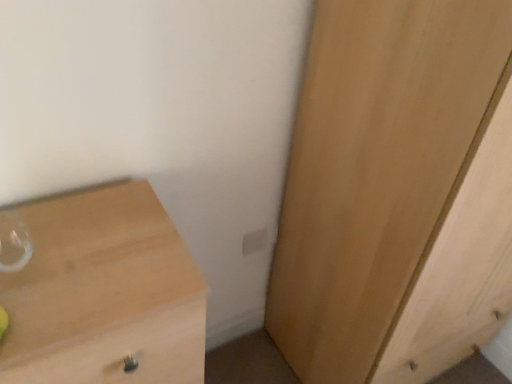
Where is `white plastic electric outlet at center`? This screenshot has height=384, width=512. white plastic electric outlet at center is located at coordinates (254, 241).

This screenshot has width=512, height=384. I want to click on light wood chest of drawers at lower left, so click(99, 291).

Find the location of `the chest of drawers located below the light wood cupboard at right (from the image's perspective)`. the chest of drawers located below the light wood cupboard at right (from the image's perspective) is located at coordinates (99, 291).

Considering the sizes of objects light wood chest of drawers at lower left and light wood cupboard at right in the image provided, who is smaller, light wood chest of drawers at lower left or light wood cupboard at right?

light wood chest of drawers at lower left.

From the image's perspective, who appears lower, light wood chest of drawers at lower left or light wood cupboard at right?

light wood chest of drawers at lower left is shown below in the image.

Which is in front, white plastic electric outlet at center or light wood cupboard at right?

light wood cupboard at right is closer to the camera.

Can we say white plastic electric outlet at center lies outside light wood cupboard at right?

Indeed, white plastic electric outlet at center is completely outside light wood cupboard at right.

Based on the photo, between white plastic electric outlet at center and light wood cupboard at right, which one has smaller size?

With smaller size is white plastic electric outlet at center.

From a real-world perspective, is white plastic electric outlet at center on top of light wood cupboard at right?

No, from a real-world perspective, white plastic electric outlet at center is not above light wood cupboard at right.

Are white plastic electric outlet at center and light wood chest of drawers at lower left far apart?

No.

Consider the image. Is white plastic electric outlet at center shorter than light wood chest of drawers at lower left?

Indeed, white plastic electric outlet at center has a lesser height compared to light wood chest of drawers at lower left.

From the image's perspective, is white plastic electric outlet at center below light wood chest of drawers at lower left?

No, from the image's perspective, white plastic electric outlet at center is not beneath light wood chest of drawers at lower left.

In the scene shown: Looking at the image, does white plastic electric outlet at center seem bigger or smaller compared to light wood chest of drawers at lower left?

In the image, white plastic electric outlet at center appears to be smaller than light wood chest of drawers at lower left.

Which is nearer, (91, 300) or (243, 254)?

The point (91, 300) is more forward.

In the image, is light wood chest of drawers at lower left positioned in front of or behind white plastic electric outlet at center?

light wood chest of drawers at lower left is positioned closer to the viewer than white plastic electric outlet at center.

Is light wood chest of drawers at lower left at the right side of white plastic electric outlet at center?

Incorrect, light wood chest of drawers at lower left is not on the right side of white plastic electric outlet at center.

Does light wood chest of drawers at lower left have a lesser height compared to white plastic electric outlet at center?

No, light wood chest of drawers at lower left is not shorter than white plastic electric outlet at center.

Based on their sizes in the image, would you say light wood cupboard at right is bigger or smaller than light wood chest of drawers at lower left?

In the image, light wood cupboard at right appears to be larger than light wood chest of drawers at lower left.

What's the angular difference between light wood cupboard at right and light wood chest of drawers at lower left's facing directions?

The facing directions of light wood cupboard at right and light wood chest of drawers at lower left are 1.04 degrees apart.

Locate an element on the screen. Image resolution: width=512 pixels, height=384 pixels. chest of drawers below the light wood cupboard at right (from the image's perspective) is located at coordinates (99, 291).

How many degrees apart are the facing directions of light wood cupboard at right and white plastic electric outlet at center?

There is a 1.91-degree angle between the facing directions of light wood cupboard at right and white plastic electric outlet at center.

Can you confirm if light wood cupboard at right is thinner than white plastic electric outlet at center?

In fact, light wood cupboard at right might be wider than white plastic electric outlet at center.

Relative to white plastic electric outlet at center, is light wood cupboard at right in front or behind?

In the image, light wood cupboard at right appears in front of white plastic electric outlet at center.

Image resolution: width=512 pixels, height=384 pixels. What are the coordinates of `cupboard in front of the light wood chest of drawers at lower left` in the screenshot? It's located at (396, 192).

I want to click on cupboard above the white plastic electric outlet at center (from the image's perspective), so click(396, 192).

Estimate the real-world distances between objects in this image. Which object is further from white plastic electric outlet at center, light wood chest of drawers at lower left or light wood cupboard at right?

light wood chest of drawers at lower left is positioned further to the anchor white plastic electric outlet at center.

Based on their spatial positions, is white plastic electric outlet at center or light wood chest of drawers at lower left further from light wood cupboard at right?

light wood chest of drawers at lower left lies further to light wood cupboard at right than the other object.

From the image, which object appears to be farther from light wood chest of drawers at lower left, white plastic electric outlet at center or light wood cupboard at right?

Based on the image, white plastic electric outlet at center appears to be further to light wood chest of drawers at lower left.

Estimate the real-world distances between objects in this image. Which object is further from light wood cupboard at right, light wood chest of drawers at lower left or white plastic electric outlet at center?

The object further to light wood cupboard at right is light wood chest of drawers at lower left.

Considering their positions, is light wood cupboard at right positioned closer to white plastic electric outlet at center than light wood chest of drawers at lower left?

Among the two, light wood cupboard at right is located nearer to white plastic electric outlet at center.

When comparing their distances from light wood chest of drawers at lower left, does light wood cupboard at right or white plastic electric outlet at center seem closer?

light wood cupboard at right.

Identify the location of chest of drawers between light wood cupboard at right and white plastic electric outlet at center along the z-axis. This screenshot has width=512, height=384. (99, 291).